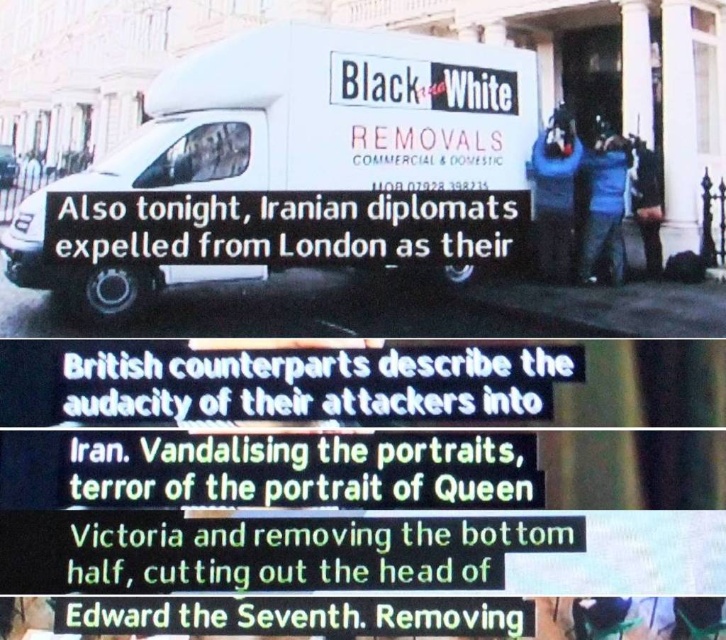
Question: Among these objects, which one is nearest to the camera?

Choices:
 (A) blue jeans at lower right
 (B) blue fabric camera at upper right
 (C) blue jeans at right
 (D) white matte van at center

Answer: (D)

Question: Among these points, which one is nearest to the camera?

Choices:
 (A) (420, 115)
 (B) (637, 193)

Answer: (A)

Question: Can you confirm if blue fabric camera at upper right is positioned above blue jeans at lower right?

Choices:
 (A) yes
 (B) no

Answer: (A)

Question: Is blue jeans at right wider than blue jeans at lower right?

Choices:
 (A) yes
 (B) no

Answer: (A)

Question: Which of these objects is positioned closest to the blue jeans at right?

Choices:
 (A) white matte van at center
 (B) blue fabric camera at upper right
 (C) blue jeans at lower right

Answer: (B)

Question: Does white matte van at center appear under blue jeans at right?

Choices:
 (A) no
 (B) yes

Answer: (B)